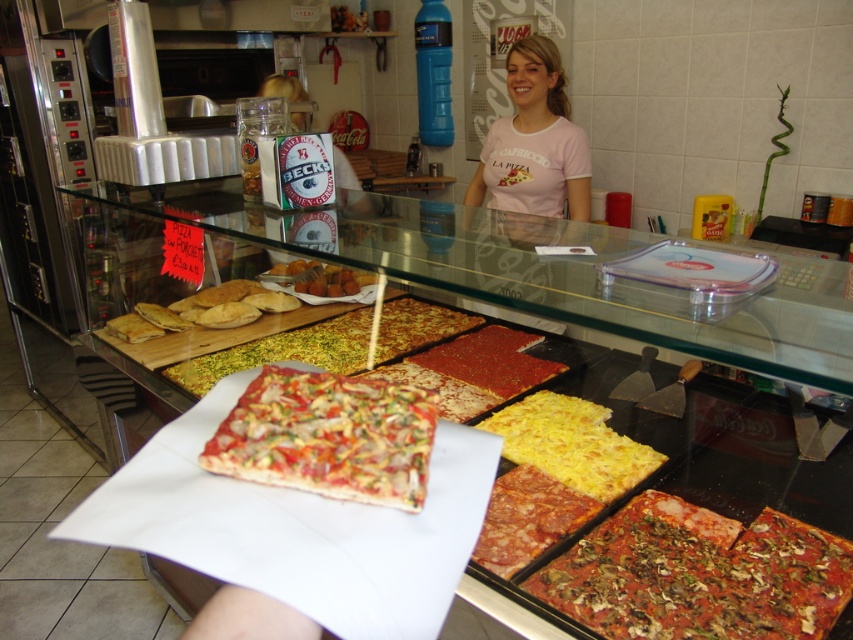
You are a customer at a pizzeria and want to order the larger pizza between the red pepperoni pizza at center and the golden crispy pizza at center. Which one should you choose?

The golden crispy pizza at center is larger than the red pepperoni pizza at center, so you should choose the golden crispy pizza at center.

You are a customer looking at the menu in the pizzeria. You see the green cardboard sign at upper center and the golden crispy pizza at center. Which object is taller?

The green cardboard sign at upper center is taller than the golden crispy pizza at center.